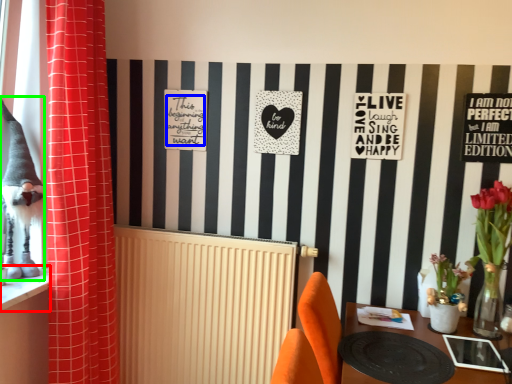
Question: Estimate the real-world distances between objects in this image. Which object is farther from window sill (highlighted by a red box), writing (highlighted by a blue box) or animal (highlighted by a green box)?

Choices:
 (A) writing
 (B) animal

Answer: (A)